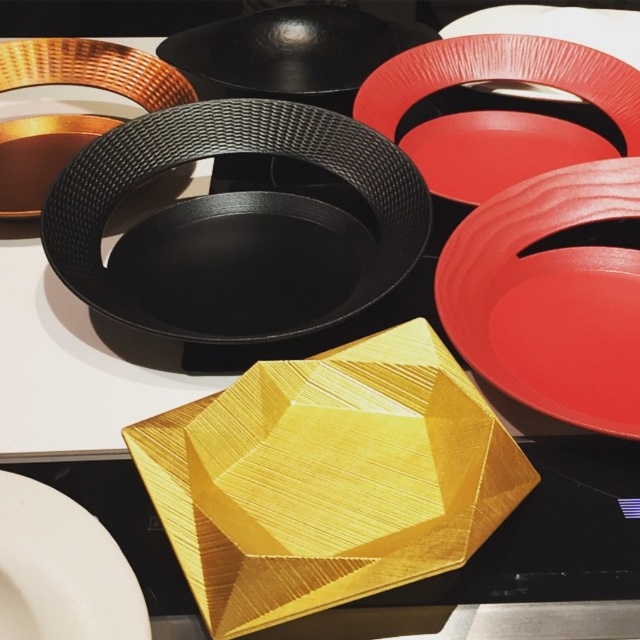
You are arranging dishes in a kitchen and need to place the white matte plate at lower left and the matte black plate at upper center on a shelf. Which plate should you place first if you want to ensure the smaller one is on the bottom?

The white matte plate at lower left is smaller than the matte black plate at upper center, so you should place the white matte plate at lower left first to ensure it is on the bottom.

What object is located at the coordinates point (234, 212)?

The point (234, 212) corresponds to the black textured platter at center.

You are arranging dishes on a shelf and need to know which is taller between the white matte plate at lower left and the matte black plate at upper center. Which one should you place on a higher shelf to avoid blocking the view of the shorter one?

The white matte plate at lower left is shorter than the matte black plate at upper center. To avoid blocking the view of the shorter plate, place the shorter white matte plate at lower left on a higher shelf so it can be seen above the taller matte black plate at upper center.